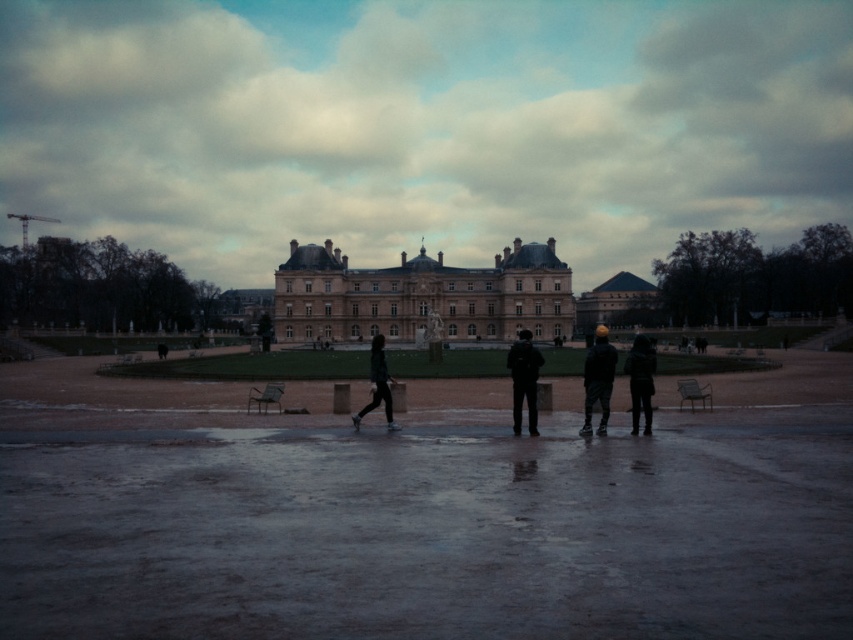
Question: Estimate the real-world distances between objects in this image. Which object is closer to the beige stone palace at center?

Choices:
 (A) dark gray hoodie at center
 (B) dark blue jacket at center
 (C) dark blue fabric jacket at center

Answer: (C)

Question: Which object is closer to the camera taking this photo?

Choices:
 (A) dark gray hoodie at center
 (B) dark gray fabric jacket at center
 (C) beige stone palace at center

Answer: (A)

Question: Can you confirm if smooth gray dome at center is thinner than dark blue jacket at center?

Choices:
 (A) yes
 (B) no

Answer: (B)

Question: Which point is closer to the camera taking this photo?

Choices:
 (A) (514, 243)
 (B) (602, 340)
 (C) (379, 356)

Answer: (B)

Question: Is smooth gray dome at center behind dark gray fabric jacket at center?

Choices:
 (A) yes
 (B) no

Answer: (A)

Question: Does beige stone palace at center appear on the right side of dark blue fabric jacket at center?

Choices:
 (A) no
 (B) yes

Answer: (A)